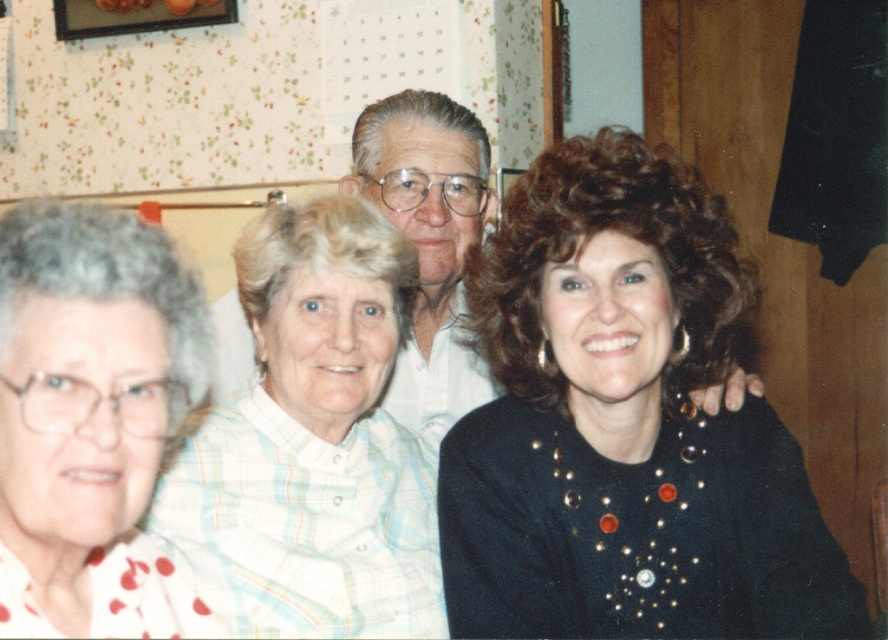
You are organizing a group photo and need to ensure that the white plaid shirt at center and the white shirt at center are visible. Based on their widths, which one might need to be adjusted to avoid overlapping with others?

The white plaid shirt at center is wider than the white shirt at center, so it might need to be adjusted to avoid overlapping with others.

Consider the image. You are organizing a charity event and need to determine which clothing item takes up more space. Based on the image, which of the two items at the center, the black sequined dress at center or the white shirt at center, is bigger in size?

The black sequined dress at center is larger in size than the white shirt at center, so it takes up more space.

You are organizing a photoshoot and need to ensure that the outfits of the models do not overlap. Given that the black sequined dress at center and the white shirt at center are both positioned at the center of the image, which outfit requires more horizontal space to avoid overlapping with other elements?

The black sequined dress at center requires more horizontal space because its width surpasses that of the white shirt at center.